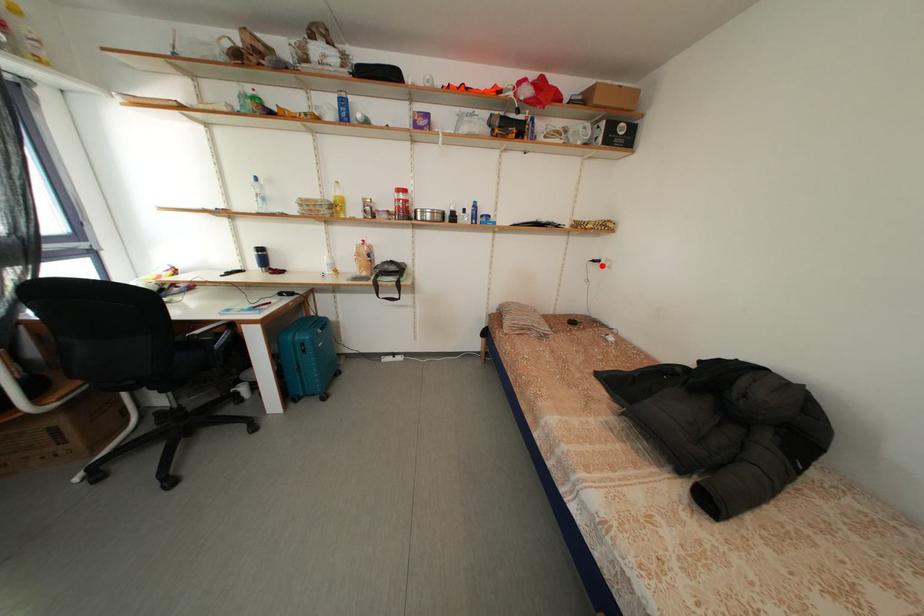
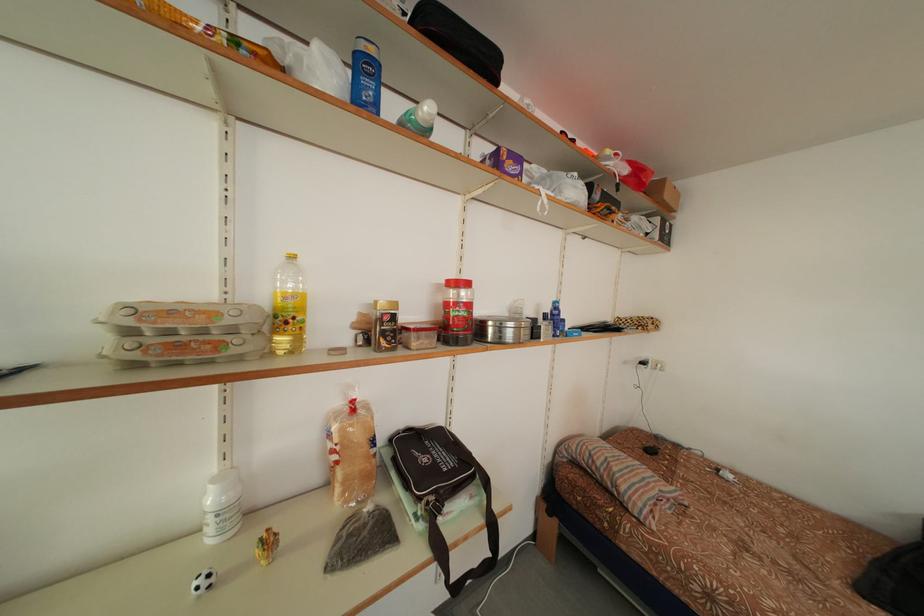
Where in the second image is the point corresponding to the highlighted location from the first image?

(650, 369)